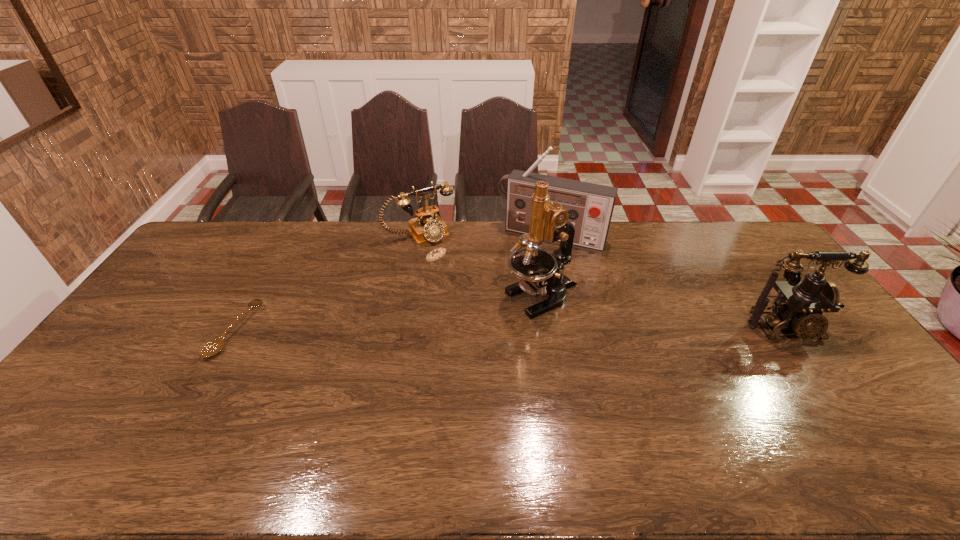
At what (x,y) coordinates should I click in order to perform the action: click on free spot located on the front panel of the radio receiver. Please return your answer as a coordinate pair (x, y). The width and height of the screenshot is (960, 540). Looking at the image, I should click on (516, 288).

At what (x,y) coordinates should I click in order to perform the action: click on free region located 0.190m on the front panel of the radio receiver. Please return your answer as a coordinate pair (x, y). Looking at the image, I should click on (518, 282).

Where is `free space located 0.340m on the front panel of the radio receiver`? The height and width of the screenshot is (540, 960). free space located 0.340m on the front panel of the radio receiver is located at coordinates (504, 312).

At what (x,y) coordinates should I click in order to perform the action: click on vacant space situated 0.210m on the dial number of the fourth object from right to left. Please return your answer as a coordinate pair (x, y). Looking at the image, I should click on (459, 278).

You are a GUI agent. You are given a task and a screenshot of the screen. Output one action in this format:
    pyautogui.click(x=<x>, y=<y>)
    Task: Click on the free space located 0.200m on the dial number of the fourth object from right to left
    This screenshot has height=540, width=960.
    Given the screenshot: What is the action you would take?
    pyautogui.click(x=457, y=276)

Where is `free space located 0.350m on the dial number of the fourth object from right to left`? The image size is (960, 540). free space located 0.350m on the dial number of the fourth object from right to left is located at coordinates (477, 303).

Identify the location of vacant space positioned 0.200m at the eyepiece of the tallest object. (455, 333).

Identify the location of vacant point located 0.110m at the eyepiece of the tallest object. (481, 322).

This screenshot has width=960, height=540. Find the location of `vacant space located 0.100m at the eyepiece of the tallest object`. vacant space located 0.100m at the eyepiece of the tallest object is located at coordinates (484, 320).

Locate an element on the screen. This screenshot has width=960, height=540. radio receiver positioned at the far edge is located at coordinates (590, 206).